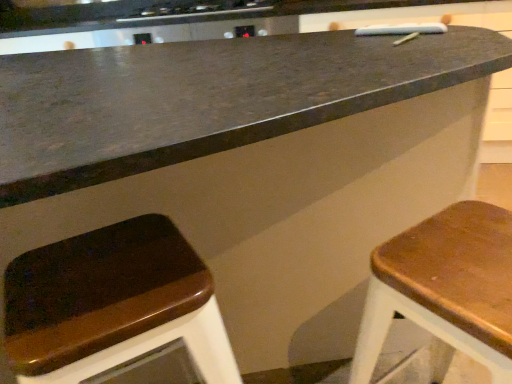
You are a GUI agent. You are given a task and a screenshot of the screen. Output one action in this format:
    pyautogui.click(x=<x>, y=<y>)
    Task: Click on the free spot above wooden seat at right, the 2th stool positioned from the left (from a real-world perspective)
    
    Given the screenshot: What is the action you would take?
    pyautogui.click(x=461, y=253)